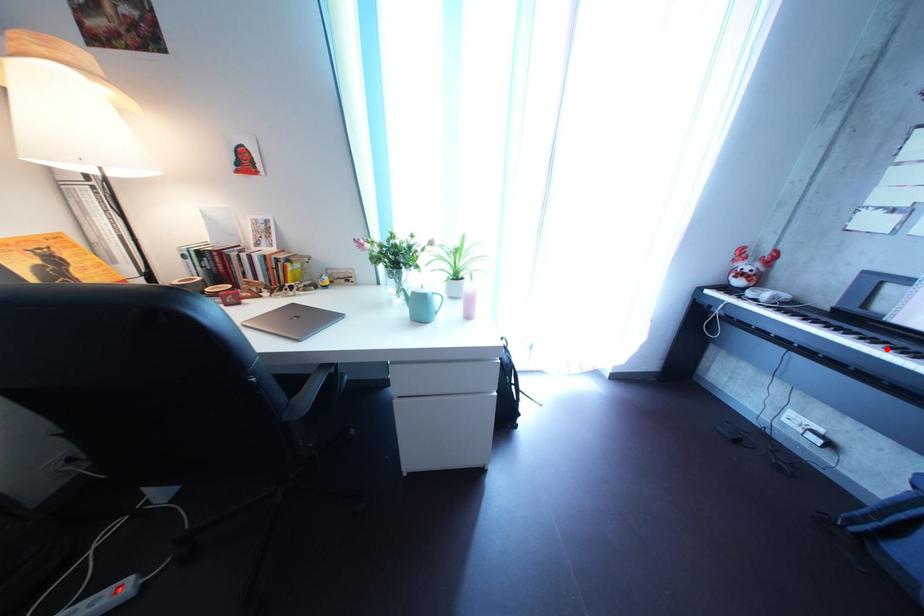
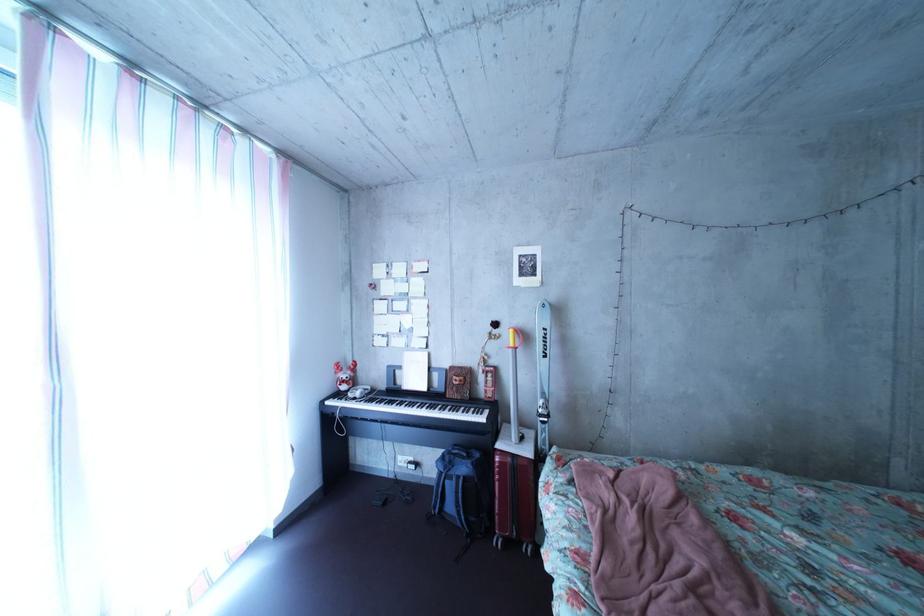
Find the pixel in the second image that matches the highlighted location in the first image.

(416, 411)